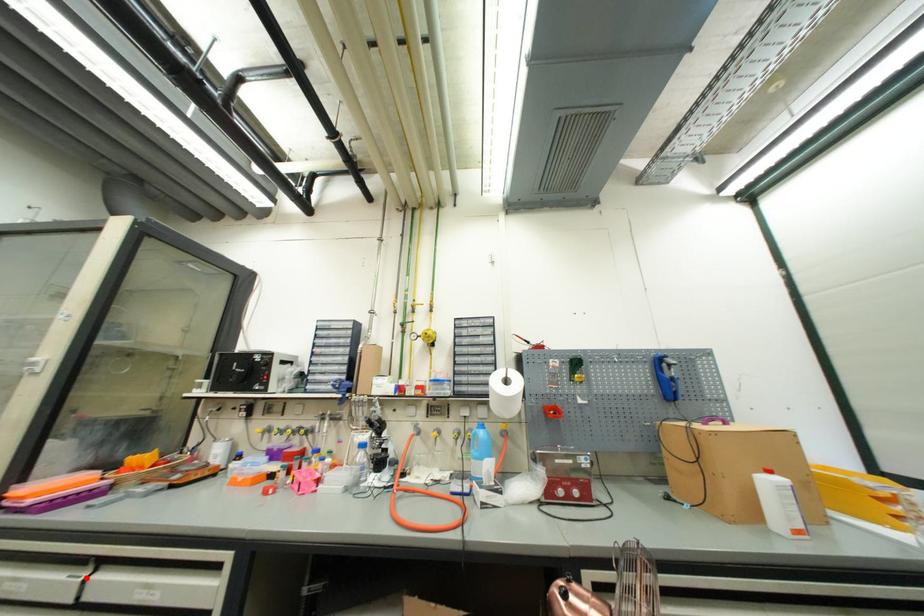
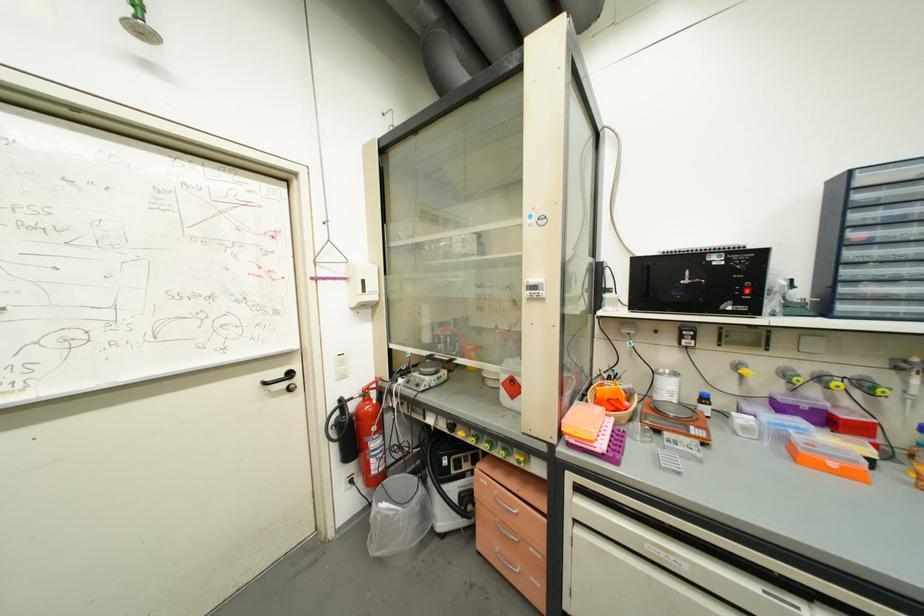
Locate, in the second image, the point that corresponds to the highlighted location in the first image.

(803, 610)